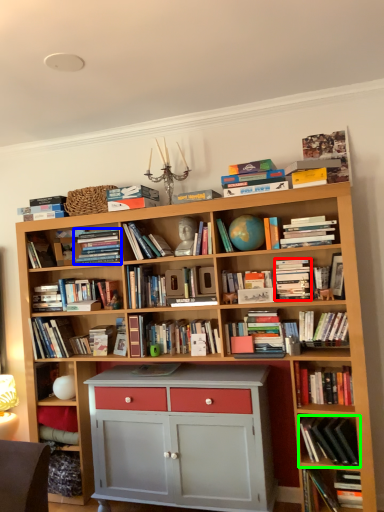
Question: Estimate the real-world distances between objects in this image. Which object is farther from paperback book (highlighted by a red box), book (highlighted by a blue box) or book (highlighted by a green box)?

Choices:
 (A) book
 (B) book

Answer: (A)